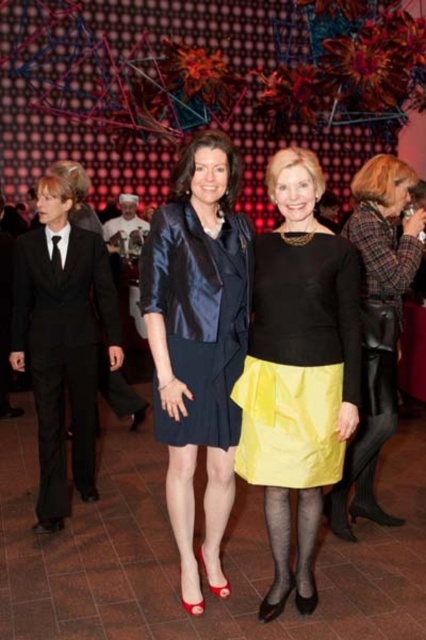
Can you confirm if yellow satin skirt at center is positioned above black suit at left?

No.

Which is in front, point (333, 500) or point (11, 257)?

Point (333, 500) is in front.

Which is in front, point (400, 301) or point (6, 285)?

Point (400, 301) is more forward.

Image resolution: width=426 pixels, height=640 pixels. What are the coordinates of `yellow satin skirt at center` in the screenshot? It's located at (379, 326).

In the scene shown: Is black satin suit at left positioned at the back of yellow satin skirt at center?

Yes, black satin suit at left is behind yellow satin skirt at center.

Which of these two, black satin suit at left or yellow satin skirt at center, stands taller?

yellow satin skirt at center

Where is `black satin suit at left`? black satin suit at left is located at coordinates (63, 353).

Which is more to the left, matte yellow skirt at center or black suit at left?

black suit at left

I want to click on matte yellow skirt at center, so click(298, 371).

Is point (270, 490) positioned before point (5, 384)?

That is True.

Where is `matte yellow skirt at center`? This screenshot has width=426, height=640. matte yellow skirt at center is located at coordinates (298, 371).